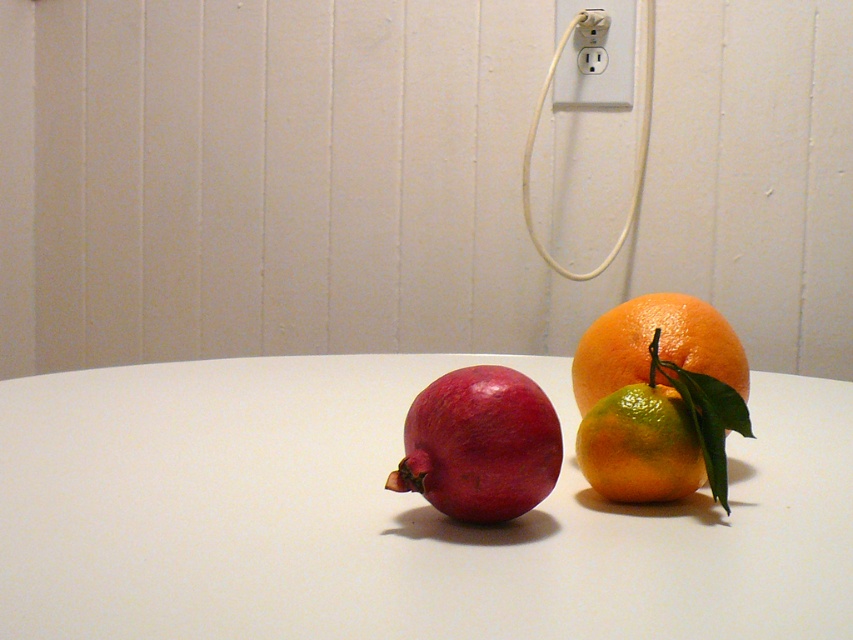
Question: From the image, what is the correct spatial relationship of orange matte at right in relation to shiny green lime at center right?

Choices:
 (A) above
 (B) below

Answer: (A)

Question: Can you confirm if orange matte at right is thinner than shiny green lime at center right?

Choices:
 (A) no
 (B) yes

Answer: (A)

Question: Considering the real-world distances, which object is closest to the matte red pomegranate at center?

Choices:
 (A) matte white table at center
 (B) white plastic outlet at upper center
 (C) orange matte at right

Answer: (C)

Question: Does orange matte at right lie behind shiny green lime at center right?

Choices:
 (A) yes
 (B) no

Answer: (A)

Question: Estimate the real-world distances between objects in this image. Which object is closer to the matte red pomegranate at center?

Choices:
 (A) matte white table at center
 (B) shiny green lime at center right

Answer: (B)

Question: Estimate the real-world distances between objects in this image. Which object is closer to the matte white table at center?

Choices:
 (A) matte red pomegranate at center
 (B) orange matte at right

Answer: (B)